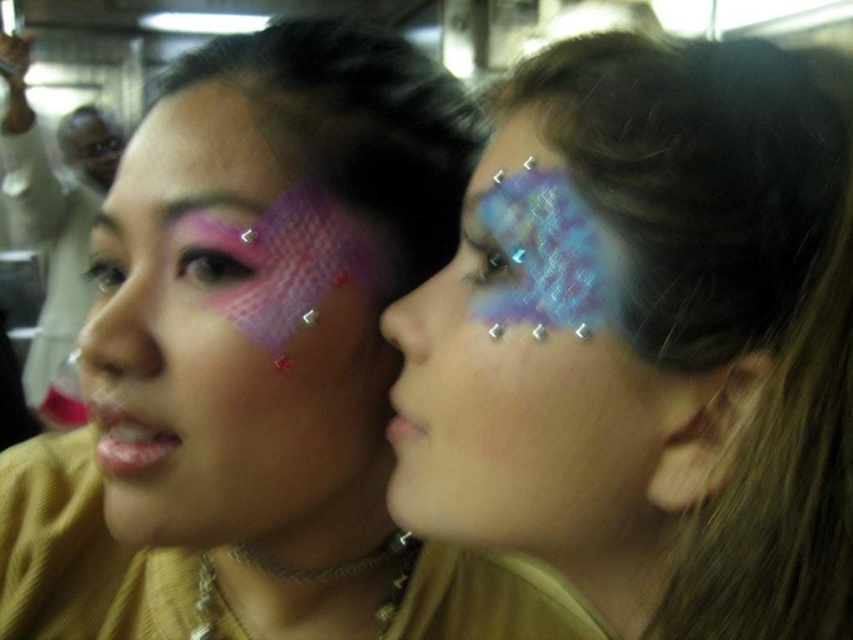
Question: Is matte pink mesh nose at left to the left of matte pink lipstick at lower center from the viewer's perspective?

Choices:
 (A) no
 (B) yes

Answer: (B)

Question: Which object is farther from the camera taking this photo?

Choices:
 (A) shiny metallic face paint at right
 (B) matte pink mesh nose at center
 (C) matte pink lipstick at lower left

Answer: (C)

Question: Is shiny metallic face paint at right thinner than matte pink mesh at upper left?

Choices:
 (A) yes
 (B) no

Answer: (B)

Question: Which of the following is the farthest from the observer?

Choices:
 (A) (134, 376)
 (B) (57, 342)

Answer: (B)

Question: Which object is farther from the camera taking this photo?

Choices:
 (A) shiny metallic face paint at right
 (B) matte pink mesh face paint at left
 (C) shiny blue face paint at right
 (D) matte pink mesh face paint at upper center

Answer: (B)

Question: Is matte pink mesh at left thinner than matte pink mesh at upper left?

Choices:
 (A) yes
 (B) no

Answer: (B)